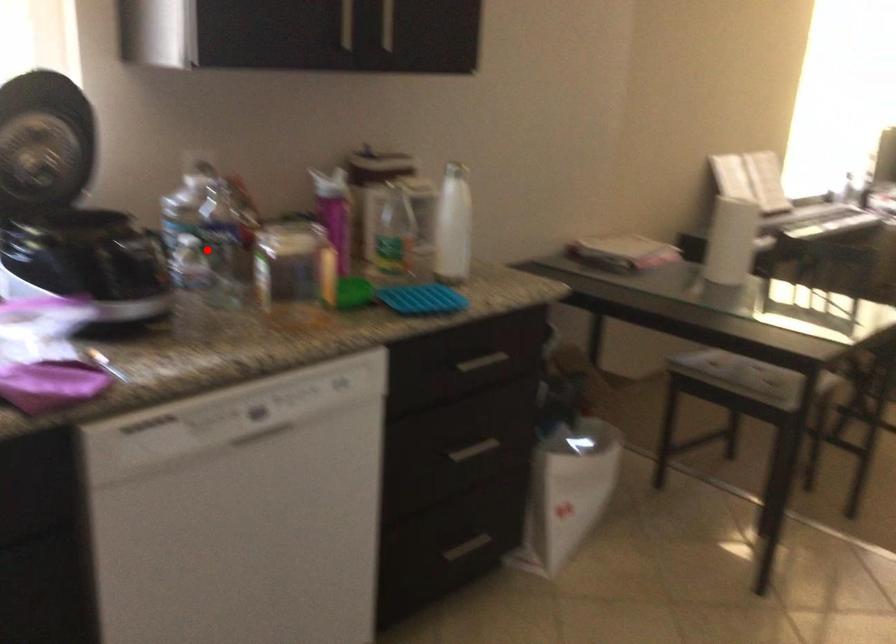
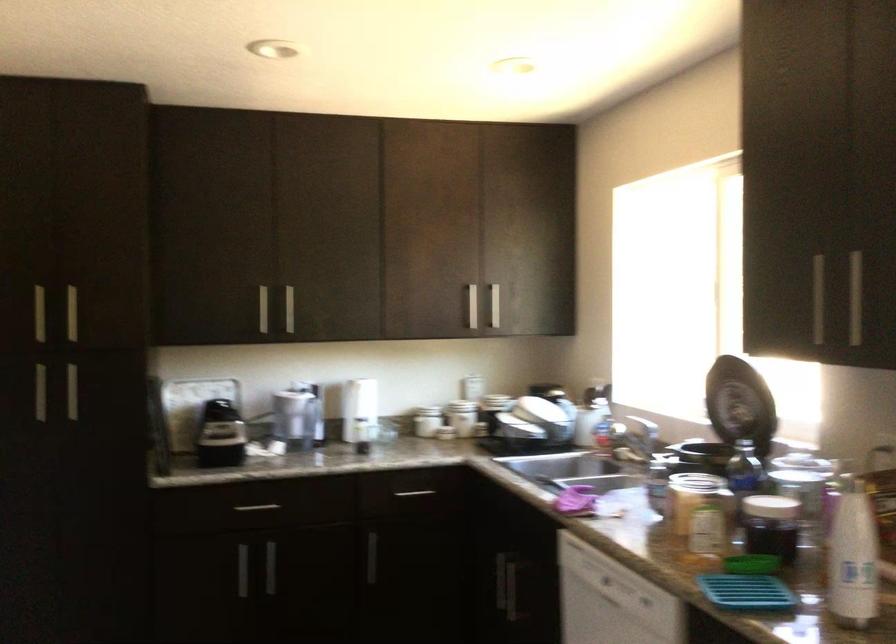
Question: I am providing you with two images of the same scene from different viewpoints. In image1, a red point is highlighted. Considering the same 3D point in image2, which of the following is correct?

Choices:
 (A) It is closer
 (B) It is farther

Answer: (B)